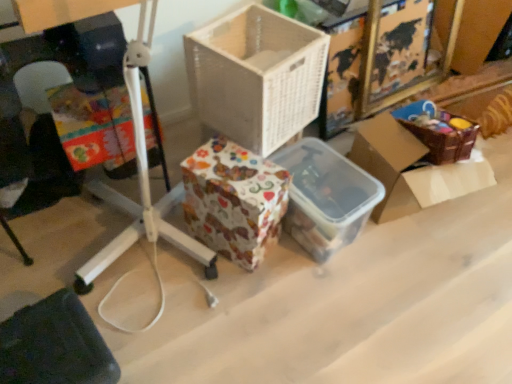
I want to click on vacant space to the left of patterned paper storage box at center, positioned as the 2th storage box in right-to-left order, so (x=164, y=263).